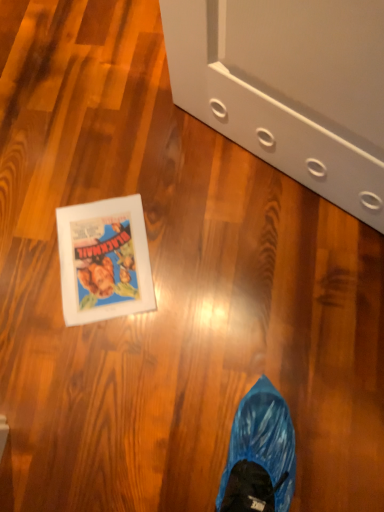
This screenshot has width=384, height=512. Find the location of `vacant region to the left of matte paper comic book at lower left`. vacant region to the left of matte paper comic book at lower left is located at coordinates (28, 266).